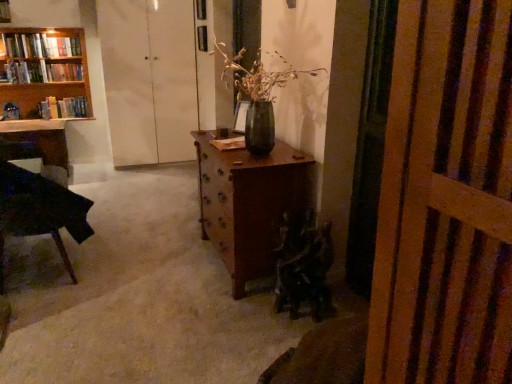
What do you see at coordinates (40, 206) in the screenshot?
I see `dark wood chair at left` at bounding box center [40, 206].

Where is `dark green fabric armchair at lower center`? dark green fabric armchair at lower center is located at coordinates (304, 269).

Based on the photo, in order to face hardcover book at upper left, which is counted as the 2th book, starting from the top, should I rotate leftwards or rightwards?

You should rotate left by 28.284 degrees.

Identify the location of hardcover book at upper left, the third book in the bottom-to-top sequence. (41, 46).

What do you see at coordinates (42, 69) in the screenshot? I see `wooden bookshelf at left` at bounding box center [42, 69].

The image size is (512, 384). Find the location of `hardcover book at upper left, which ranks as the 1th book in top-to-bottom order`. hardcover book at upper left, which ranks as the 1th book in top-to-bottom order is located at coordinates (x=62, y=46).

Identify the location of wooden bookshelf at upper left, arranged as the third book when viewed from the top. (x=42, y=72).

The width and height of the screenshot is (512, 384). Find the location of `hardcover book at left, which appears as the 4th book when viewed from the top`. hardcover book at left, which appears as the 4th book when viewed from the top is located at coordinates (63, 108).

Is dark wood chair at left to the right of dark green fabric armchair at lower center from the viewer's perspective?

In fact, dark wood chair at left is to the left of dark green fabric armchair at lower center.

Which object is more forward, dark wood chair at left or dark green fabric armchair at lower center?

dark green fabric armchair at lower center is more forward.

From the image's perspective, which is above, dark wood chair at left or dark green fabric armchair at lower center?

From the image's view, dark wood chair at left is above.

Considering the sizes of objects dark wood chair at left and dark green fabric armchair at lower center in the image provided, who is bigger, dark wood chair at left or dark green fabric armchair at lower center?

dark wood chair at left.

Which is correct: matte dark green vase at center is inside dark wood chair at left, or outside of it?

matte dark green vase at center cannot be found inside dark wood chair at left.

This screenshot has width=512, height=384. In the image, there is a dark wood chair at left. In order to click on houseplant above it (from the image's perspective) in this screenshot , I will do `click(259, 96)`.

Measure the distance from matte dark green vase at center to dark wood chair at left.

matte dark green vase at center is 4.53 feet away from dark wood chair at left.

Is point (250, 101) closer or farther from the camera than point (69, 270)?

Point (250, 101).

Considering the relative positions of dark wood chair at left and hardcover book at left, which appears as the 4th book when viewed from the top, in the image provided, is dark wood chair at left to the left of hardcover book at left, which appears as the 4th book when viewed from the top, from the viewer's perspective?

Incorrect, dark wood chair at left is not on the left side of hardcover book at left, which appears as the 4th book when viewed from the top.

Is dark wood chair at left not close to hardcover book at left, which appears as the 4th book when viewed from the top?

dark wood chair at left is far away from hardcover book at left, which appears as the 4th book when viewed from the top.

Is point (60, 193) closer to viewer compared to point (42, 107)?

Yes, point (60, 193) is in front of point (42, 107).

Considering the positions of objects dark wood chair at left and hardcover book at left, acting as the 1th book starting from the bottom, in the image provided, who is behind, dark wood chair at left or hardcover book at left, acting as the 1th book starting from the bottom,?

hardcover book at left, acting as the 1th book starting from the bottom, is further from the camera.

From the image's perspective, between wooden bookshelf at left and matte dark green vase at center, which one is located above?

wooden bookshelf at left.

Considering their positions, is wooden bookshelf at left located in front of or behind matte dark green vase at center?

Clearly, wooden bookshelf at left is behind matte dark green vase at center.

Measure the distance from wooden bookshelf at left to matte dark green vase at center.

2.49 meters.

Is wooden bookshelf at left far away from matte dark green vase at center?

wooden bookshelf at left is positioned a significant distance from matte dark green vase at center.

From the image's perspective, would you say dark green fabric armchair at lower center is positioned over matte dark green vase at center?

Incorrect, from the image's perspective, dark green fabric armchair at lower center is lower than matte dark green vase at center.

Is matte dark green vase at center at the back of dark green fabric armchair at lower center?

No, dark green fabric armchair at lower center is not facing the opposite direction of matte dark green vase at center.

In the scene shown: Which is closer to the camera, (285, 243) or (266, 74)?

The point (285, 243) is closer.

From the picture: Is dark green fabric armchair at lower center positioned far away from matte dark green vase at center?

dark green fabric armchair at lower center is actually quite close to matte dark green vase at center.

Which is nearer, (187, 108) or (41, 53)?

Point (187, 108).

Is white matte cabinet at upper center facing towards hardcover book at upper left, which is counted as the 2th book, starting from the top?

No, white matte cabinet at upper center is not oriented towards hardcover book at upper left, which is counted as the 2th book, starting from the top.

Can you confirm if white matte cabinet at upper center is bigger than hardcover book at upper left, which is counted as the 2th book, starting from the top?

Yes, white matte cabinet at upper center is bigger than hardcover book at upper left, which is counted as the 2th book, starting from the top.

In the scene shown: Is white matte cabinet at upper center far away from hardcover book at upper left, which is counted as the 2th book, starting from the top?

No.

In the image, is dark green fabric armchair at lower center positioned in front of or behind hardcover book at upper left, which is counted as the 2th book, starting from the top?

dark green fabric armchair at lower center is in front of hardcover book at upper left, which is counted as the 2th book, starting from the top.

Locate an element on the screen. armchair that appears below the hardcover book at upper left, which is counted as the 2th book, starting from the top (from the image's perspective) is located at coordinates (304, 269).

How different are the orientations of dark green fabric armchair at lower center and hardcover book at upper left, the third book in the bottom-to-top sequence, in degrees?

91 degrees separate the facing orientations of dark green fabric armchair at lower center and hardcover book at upper left, the third book in the bottom-to-top sequence.

Could hardcover book at upper left, which is counted as the 2th book, starting from the top, be considered to be inside dark green fabric armchair at lower center?

That's incorrect, hardcover book at upper left, which is counted as the 2th book, starting from the top, is not inside dark green fabric armchair at lower center.

Where is `chair above the dark green fabric armchair at lower center (from the image's perspective)`? The height and width of the screenshot is (384, 512). chair above the dark green fabric armchair at lower center (from the image's perspective) is located at coordinates [x=40, y=206].

Identify the location of houseplant on the right of the dark wood chair at left. (259, 96).

Estimate the real-world distances between objects in this image. Which object is further from dark green fabric armchair at lower center, brown wood table at center or hardcover book at left, acting as the 1th book starting from the bottom?

Based on the image, hardcover book at left, acting as the 1th book starting from the bottom, appears to be further to dark green fabric armchair at lower center.

Considering their positions, is white matte cabinet at upper center positioned further to matte black desk at left than wooden bookshelf at upper left, which is the 2th book in bottom-to-top order?

white matte cabinet at upper center is further to matte black desk at left.

Which object lies nearer to the anchor point wooden bookshelf at upper left, which is the 2th book in bottom-to-top order, hardcover book at left, which appears as the 4th book when viewed from the top, or dark green fabric armchair at lower center?

Among the two, hardcover book at left, which appears as the 4th book when viewed from the top, is located nearer to wooden bookshelf at upper left, which is the 2th book in bottom-to-top order.

Based on their spatial positions, is matte black desk at left or dark green fabric armchair at lower center further from wooden bookshelf at left?

Answer: Based on the image, dark green fabric armchair at lower center appears to be further to wooden bookshelf at left.

When comparing their distances from wooden bookshelf at left, does wooden bookshelf at upper left, arranged as the third book when viewed from the top, or brown wood table at center seem further?

brown wood table at center lies further to wooden bookshelf at left than the other object.

From the image, which object appears to be nearer to white matte cabinet at upper center, matte dark green vase at center or wooden bookshelf at left?

The object closer to white matte cabinet at upper center is wooden bookshelf at left.

Looking at the image, which one is located further to wooden bookshelf at left, hardcover book at left, acting as the 1th book starting from the bottom, or matte black desk at left?

matte black desk at left is positioned further to the anchor wooden bookshelf at left.

Estimate the real-world distances between objects in this image. Which object is closer to hardcover book at upper left, which is counted as the 2th book, starting from the top, hardcover book at upper left, which ranks as the 1th book in top-to-bottom order, or wooden bookshelf at upper left, arranged as the third book when viewed from the top?

The object closer to hardcover book at upper left, which is counted as the 2th book, starting from the top, is hardcover book at upper left, which ranks as the 1th book in top-to-bottom order.

In order to click on chair located between matte black desk at left and brown wood table at center in the left-right direction in this screenshot , I will do `click(40, 206)`.

What are the coordinates of `chair positioned between matte dark green vase at center and matte black desk at left from near to far` in the screenshot? It's located at tap(40, 206).

Locate an element on the screen. screen door positioned between matte dark green vase at center and wooden bookshelf at left from near to far is located at coordinates (149, 79).

This screenshot has height=384, width=512. I want to click on bookcase that lies between hardcover book at upper left, which ranks as the 1th book in top-to-bottom order, and hardcover book at left, which appears as the 4th book when viewed from the top, from top to bottom, so click(42, 69).